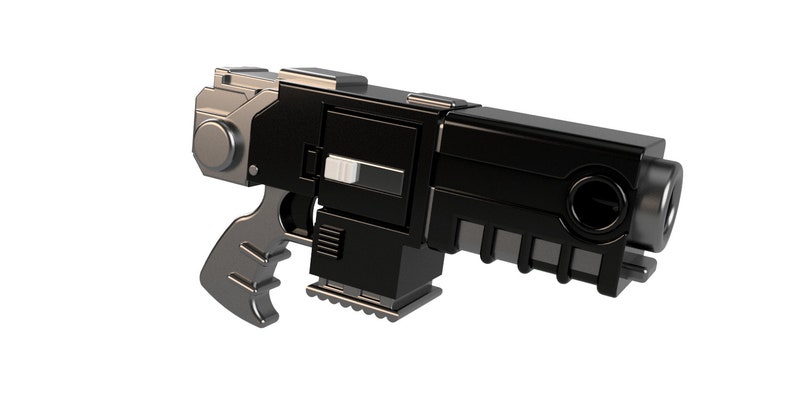
This screenshot has width=794, height=410. I want to click on silver handle, so pyautogui.click(x=233, y=260).